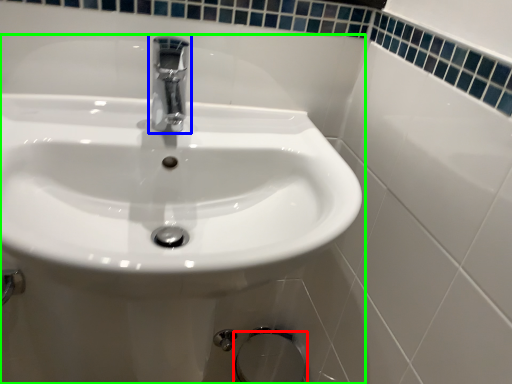
Question: Estimate the real-world distances between objects in this image. Which object is closer to bidet (highlighted by a red box), tap (highlighted by a blue box) or sink (highlighted by a green box)?

Choices:
 (A) tap
 (B) sink

Answer: (B)